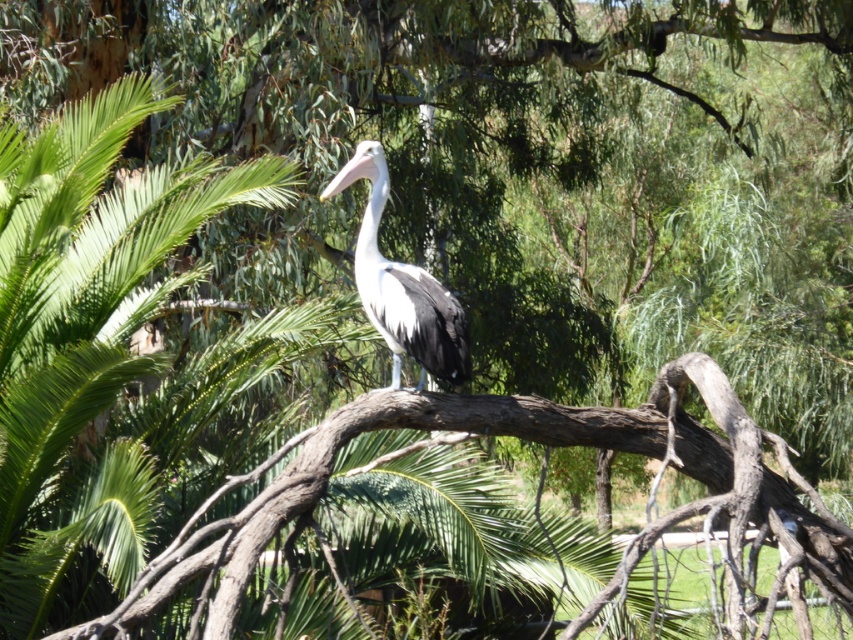
You are a birdwatcher observing the scene. You notice the green leafy palm tree at upper left and the white glossy pelican at center. Which object is taller in the image?

The green leafy palm tree at upper left is taller than the white glossy pelican at center.

You are a birdwatcher observing the scene. You notice the brown rough tree branch at center and the white glossy pelican at center. Which object is taller in this view?

The brown rough tree branch at center is much taller than the white glossy pelican at center.

You are a birdwatcher observing the scene. You notice the green leafy palm tree at upper left and the brown rough tree branch at center. Which object would you estimate to be bigger in size?

The green leafy palm tree at upper left is larger in size than the brown rough tree branch at center, so the green leafy palm tree at upper left would be the bigger one.